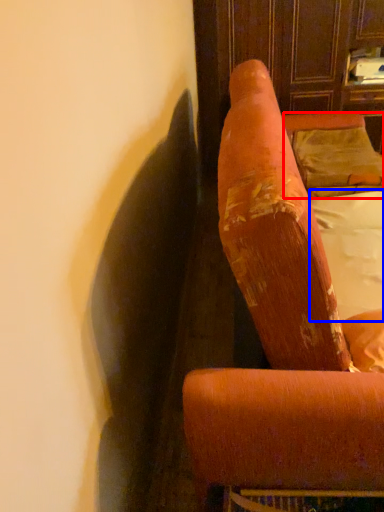
Question: Which object is further to the camera taking this photo, pillow (highlighted by a red box) or sheet (highlighted by a blue box)?

Choices:
 (A) pillow
 (B) sheet

Answer: (A)